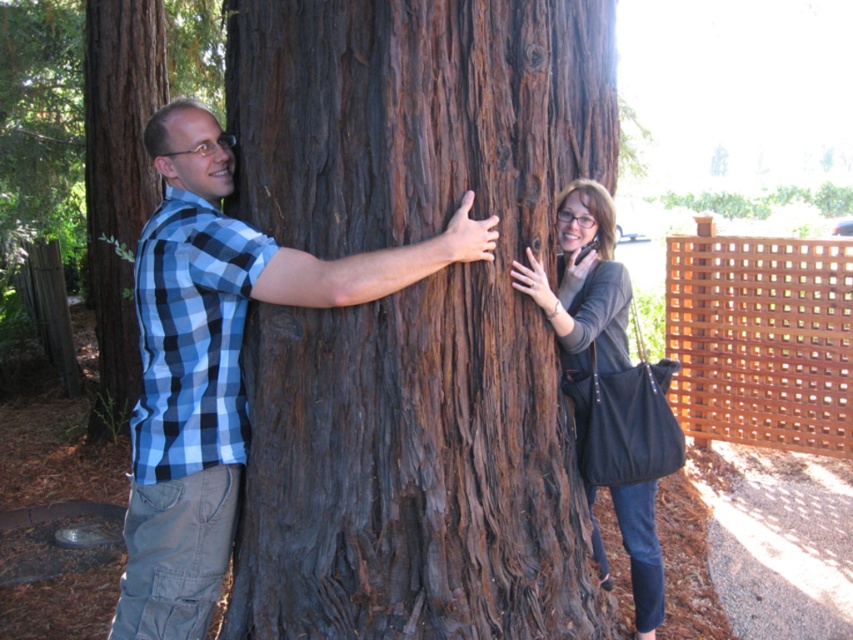
Question: Which object appears closest to the camera in this image?

Choices:
 (A) blue plaid shirt at left
 (B) brown rough bark at left

Answer: (A)

Question: Which object is positioned closest to the blue plaid shirt at left?

Choices:
 (A) brown rough bark at center
 (B) matte gray sweater at right

Answer: (A)

Question: Is blue plaid shirt at left thinner than matte gray sweater at right?

Choices:
 (A) yes
 (B) no

Answer: (B)

Question: From the image, what is the correct spatial relationship of matte gray sweater at right in relation to brown rough bark at left?

Choices:
 (A) above
 (B) below

Answer: (B)

Question: Is blue plaid shirt at left bigger than brown rough bark at left?

Choices:
 (A) no
 (B) yes

Answer: (A)

Question: Which object appears farthest from the camera in this image?

Choices:
 (A) brown rough bark at center
 (B) brown rough bark at left
 (C) matte gray sweater at right
 (D) blue plaid shirt at left

Answer: (B)